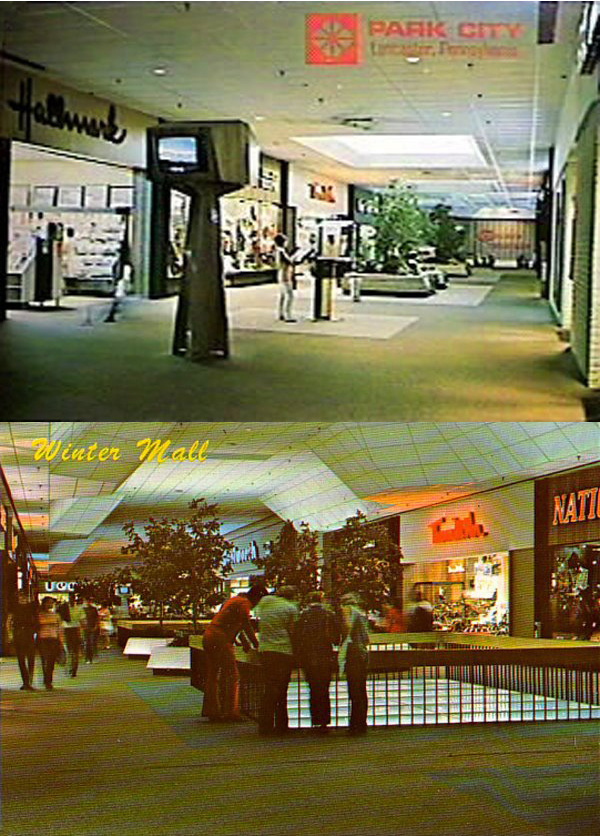
Where is `benches`? Image resolution: width=600 pixels, height=836 pixels. benches is located at coordinates (399, 288), (457, 273).